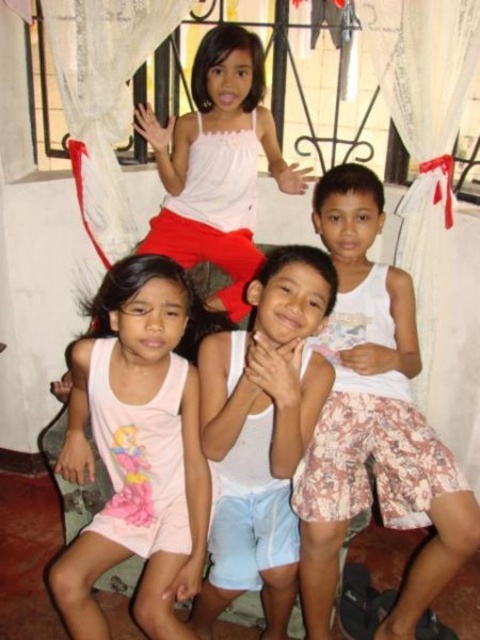
Can you confirm if white cotton tank top at center is positioned to the right of white matte tank top at upper center?

Yes, white cotton tank top at center is to the right of white matte tank top at upper center.

Which is more to the left, white cotton tank top at center or white matte tank top at upper center?

Positioned to the left is white matte tank top at upper center.

The height and width of the screenshot is (640, 480). Describe the element at coordinates (373, 420) in the screenshot. I see `white cotton tank top at center` at that location.

This screenshot has height=640, width=480. Find the location of `white cotton tank top at center`. white cotton tank top at center is located at coordinates (373, 420).

Which of these two, white cotton shirt at center or white matte tank top at upper center, stands shorter?

white matte tank top at upper center

What do you see at coordinates (268, 369) in the screenshot? The width and height of the screenshot is (480, 640). I see `white cotton shirt at center` at bounding box center [268, 369].

Find the location of `white cotton shirt at center`. white cotton shirt at center is located at coordinates (268, 369).

Is point (406, 376) behind point (288, 248)?

Yes, it is.

Can you confirm if white cotton tank top at center is smaller than white cotton shirt at center?

No, white cotton tank top at center is not smaller than white cotton shirt at center.

The image size is (480, 640). I want to click on white cotton tank top at center, so click(373, 420).